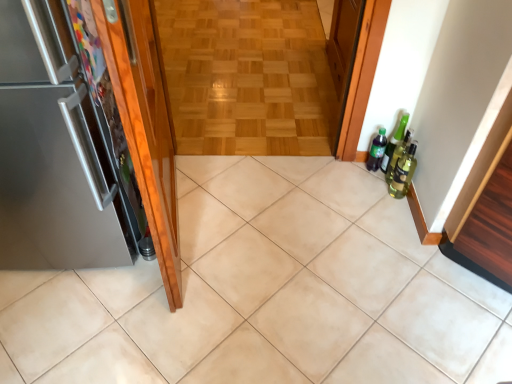
At what (x,y) coordinates should I click in order to perform the action: click on empty space that is in between satin metallic refrigerator at left, which is the 2th door in right-to-left order, and wooden cabinet at right. Please return your answer as a coordinate pair (x, y). The image size is (512, 384). Looking at the image, I should click on (298, 261).